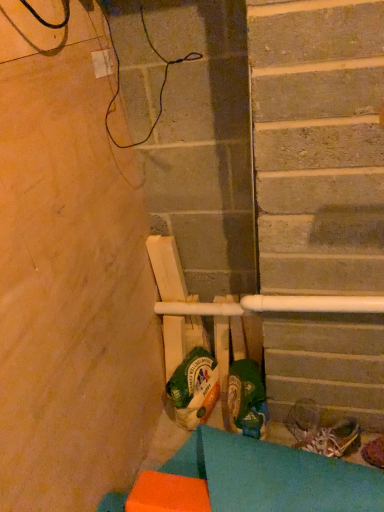
Question: Is shiny metallic shoes at lower right, the 2th footwear positioned from the left, completely or partially outside of green fabric shoe at center, the 1th footwear viewed from the left?

Choices:
 (A) no
 (B) yes

Answer: (B)

Question: From a real-world perspective, is shiny metallic shoes at lower right, the 2th footwear positioned from the left, under green fabric shoe at center, the 1th footwear viewed from the left?

Choices:
 (A) no
 (B) yes

Answer: (B)

Question: Is shiny metallic shoes at lower right, the 2th footwear in the right-to-left sequence, in contact with green fabric shoe at center, the 1th footwear viewed from the left?

Choices:
 (A) no
 (B) yes

Answer: (A)

Question: Could you tell me if shiny metallic shoes at lower right, the 2th footwear positioned from the left, is turned towards green fabric shoe at center, the 1th footwear viewed from the left?

Choices:
 (A) no
 (B) yes

Answer: (A)

Question: Does shiny metallic shoes at lower right, the 2th footwear positioned from the left, have a lesser width compared to green fabric shoe at center, the 3th footwear when ordered from right to left?

Choices:
 (A) yes
 (B) no

Answer: (B)

Question: Considering the relative positions of shiny metallic shoes at lower right, the 2th footwear positioned from the left, and orange foam block at lower left in the image provided, is shiny metallic shoes at lower right, the 2th footwear positioned from the left, to the left or to the right of orange foam block at lower left?

Choices:
 (A) left
 (B) right

Answer: (B)

Question: Based on their sizes in the image, would you say shiny metallic shoes at lower right, the 2th footwear positioned from the left, is bigger or smaller than orange foam block at lower left?

Choices:
 (A) big
 (B) small

Answer: (B)

Question: Is point (x=311, y=407) closer or farther from the camera than point (x=223, y=455)?

Choices:
 (A) closer
 (B) farther

Answer: (B)

Question: Is shiny metallic shoes at lower right, the 2th footwear positioned from the left, taller or shorter than orange foam block at lower left?

Choices:
 (A) short
 (B) tall

Answer: (A)

Question: In the image, is green fabric shoe at center, the 1th footwear viewed from the left, on the left side or the right side of orange foam block at lower left?

Choices:
 (A) right
 (B) left

Answer: (A)

Question: Looking at the image, does green fabric shoe at center, the 1th footwear viewed from the left, seem bigger or smaller compared to orange foam block at lower left?

Choices:
 (A) big
 (B) small

Answer: (B)

Question: From the image's perspective, is green fabric shoe at center, the 1th footwear viewed from the left, positioned above or below orange foam block at lower left?

Choices:
 (A) above
 (B) below

Answer: (A)

Question: From their relative heights in the image, would you say green fabric shoe at center, the 1th footwear viewed from the left, is taller or shorter than orange foam block at lower left?

Choices:
 (A) short
 (B) tall

Answer: (B)

Question: Considering the positions of green fabric shoe at center, the 1th footwear viewed from the left, and shiny metallic shoes at lower right, the 2th footwear positioned from the left, in the image, is green fabric shoe at center, the 1th footwear viewed from the left, bigger or smaller than shiny metallic shoes at lower right, the 2th footwear positioned from the left,?

Choices:
 (A) big
 (B) small

Answer: (A)

Question: Considering their positions, is green fabric shoe at center, the 1th footwear viewed from the left, located in front of or behind shiny metallic shoes at lower right, the 2th footwear in the right-to-left sequence?

Choices:
 (A) front
 (B) behind

Answer: (A)